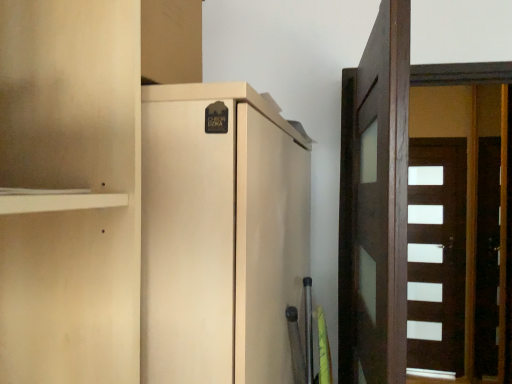
Question: Should I look upward or downward to see matte beige cupboard at center?

Choices:
 (A) up
 (B) down

Answer: (B)

Question: Is white glossy door at right, the 1th door in the right-to-left sequence, beside dark brown wood door at right, acting as the 2th door starting from the back?

Choices:
 (A) yes
 (B) no

Answer: (B)

Question: Is white glossy door at right, acting as the first door starting from the back, taller than dark brown wood door at right, acting as the 2th door starting from the back?

Choices:
 (A) yes
 (B) no

Answer: (A)

Question: Is white glossy door at right, the 1th door in the right-to-left sequence, positioned with its back to dark brown wood door at right, placed as the first door when sorted from front to back?

Choices:
 (A) no
 (B) yes

Answer: (A)

Question: From the image's perspective, is white glossy door at right, which ranks as the second door in left-to-right order, over dark brown wood door at right, the first door from the left?

Choices:
 (A) yes
 (B) no

Answer: (B)

Question: Is white glossy door at right, acting as the first door starting from the back, at the right side of dark brown wood door at right, which is the second door from right to left?

Choices:
 (A) yes
 (B) no

Answer: (A)

Question: Can we say white glossy door at right, acting as the first door starting from the back, lies outside dark brown wood door at right, acting as the 2th door starting from the back?

Choices:
 (A) yes
 (B) no

Answer: (A)

Question: Is dark brown wood door at right, placed as the first door when sorted from front to back, further to camera compared to matte beige cupboard at center?

Choices:
 (A) no
 (B) yes

Answer: (B)

Question: From a real-world perspective, is dark brown wood door at right, acting as the 2th door starting from the back, physically below matte beige cupboard at center?

Choices:
 (A) no
 (B) yes

Answer: (A)

Question: Would you say dark brown wood door at right, placed as the first door when sorted from front to back, contains matte beige cupboard at center?

Choices:
 (A) yes
 (B) no

Answer: (B)

Question: Considering the relative positions of dark brown wood door at right, which is the second door from right to left, and matte beige cupboard at center in the image provided, is dark brown wood door at right, which is the second door from right to left, to the left of matte beige cupboard at center from the viewer's perspective?

Choices:
 (A) no
 (B) yes

Answer: (A)

Question: Is dark brown wood door at right, acting as the 2th door starting from the back, thinner than matte beige cupboard at center?

Choices:
 (A) no
 (B) yes

Answer: (A)

Question: Is dark brown wood door at right, the first door from the left, far away from matte beige cupboard at center?

Choices:
 (A) no
 (B) yes

Answer: (A)

Question: Is matte beige cupboard at center looking in the opposite direction of dark brown wood door at right, the first door from the left?

Choices:
 (A) yes
 (B) no

Answer: (B)